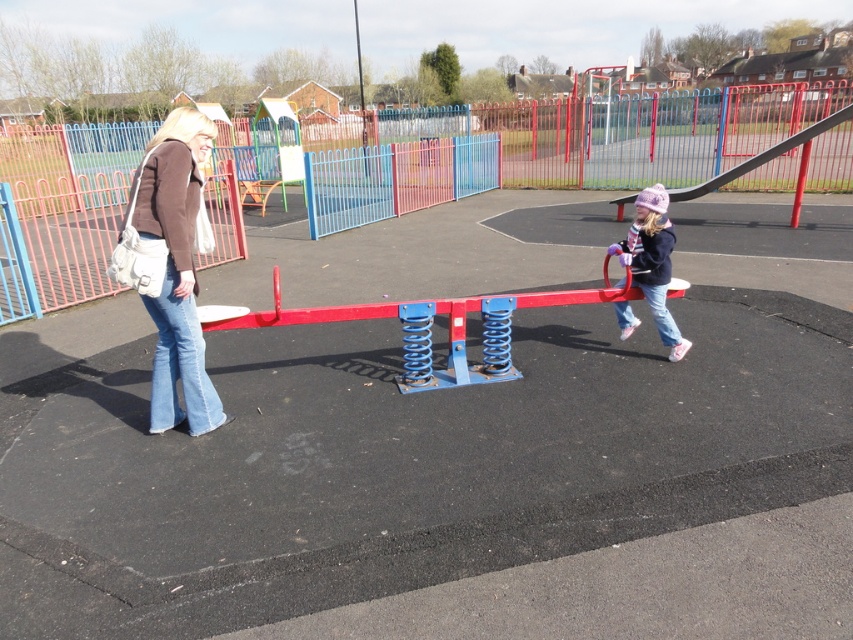
This screenshot has height=640, width=853. Identify the location of denim jeans at left. (171, 268).

Between point (167, 380) and point (650, 259), which one is positioned behind?

Positioned behind is point (650, 259).

You are a GUI agent. You are given a task and a screenshot of the screen. Output one action in this format:
    pyautogui.click(x=<x>, y=<y>)
    Task: Click on the denim jeans at left
    The image size is (853, 640).
    Given the screenshot: What is the action you would take?
    pyautogui.click(x=171, y=268)

Can you confirm if matte purple hat at center is positioned above metallic gray slide at right?

Incorrect, matte purple hat at center is not positioned above metallic gray slide at right.

Does matte purple hat at center have a smaller size compared to metallic gray slide at right?

Correct, matte purple hat at center occupies less space than metallic gray slide at right.

Is point (643, 269) in front of point (706, 189)?

Yes.

At what (x,y) coordinates should I click in order to perform the action: click on matte purple hat at center. Please return your answer as a coordinate pair (x, y). This screenshot has width=853, height=640. Looking at the image, I should click on (653, 260).

Between denim jeans at left and metallic gray slide at right, which one appears on the right side from the viewer's perspective?

From the viewer's perspective, metallic gray slide at right appears more on the right side.

Does denim jeans at left have a lesser width compared to metallic gray slide at right?

Yes.

Does point (189, 278) lie in front of point (741, 172)?

That is True.

In order to click on denim jeans at left in this screenshot , I will do `click(171, 268)`.